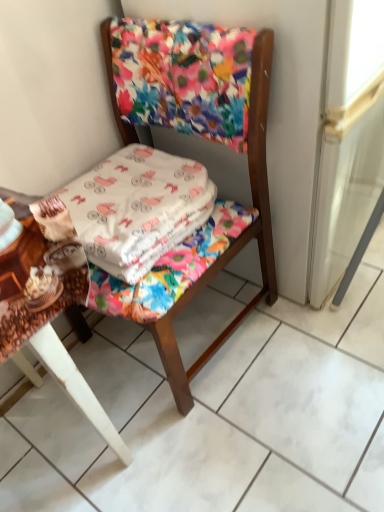
You are a GUI agent. You are given a task and a screenshot of the screen. Output one action in this format:
    pyautogui.click(x=<x>, y=<y>)
    Task: Click on the vacant space positioned to the left of wooden table at lower left
    
    Given the screenshot: What is the action you would take?
    pyautogui.click(x=29, y=438)